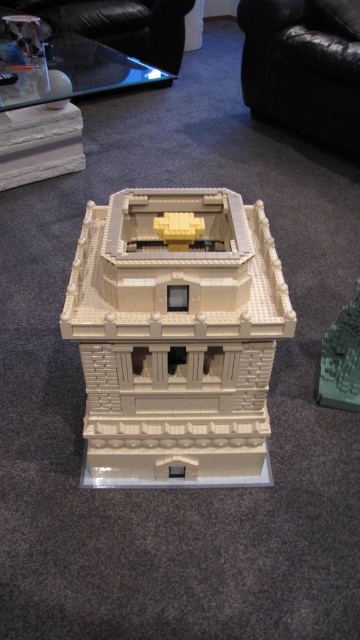
You are a LEGO enthusiast trying to place a new accessory on the beige lego tower at center and the green matte brick at right. Since you want to ensure the accessory fits properly, can you determine which object requires a larger accessory based on their sizes?

The beige lego tower at center has a larger size compared to the green matte brick at right, so it requires a larger accessory to fit properly.

You are a toy collector standing in front of the LEGO model. You want to place a small figurine between the beige lego tower at center and the green matte brick at right. Which object should you place the figurine closer to if you want it to appear closer to you?

You should place the figurine closer to the beige lego tower at center because it is already closer to the viewer than the green matte brick at right.

You are a LEGO architect designing a new structure. You have a beige lego tower at center and a green matte brick at right in your design. Which element should you choose if you want to place a decorative golden statue on top, considering their heights?

The beige lego tower at center should be chosen because it has a greater height compared to the green matte brick at right, providing a stable and elevated base for the golden statue.